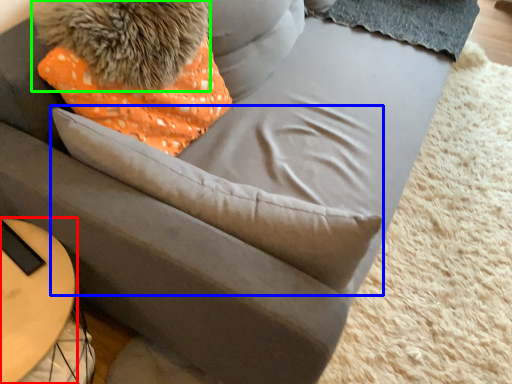
Question: Based on their relative distances, which object is nearer to table (highlighted by a red box)? Choose from throw pillow (highlighted by a blue box) and animal (highlighted by a green box).

Choices:
 (A) throw pillow
 (B) animal

Answer: (A)